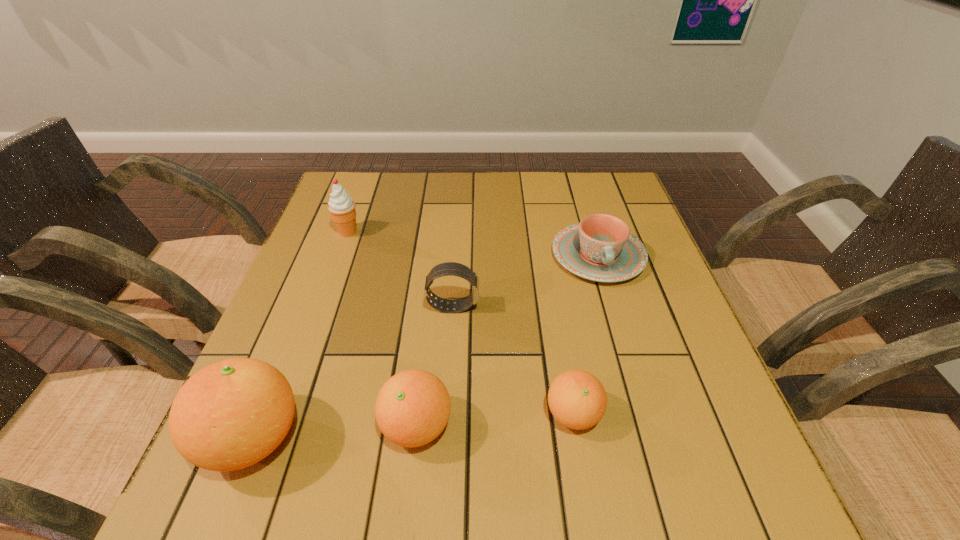
This screenshot has height=540, width=960. Find the location of `free region at the near left corner of the desktop`. free region at the near left corner of the desktop is located at coordinates (310, 436).

The height and width of the screenshot is (540, 960). Find the location of `vacant position at the far right corner of the desktop`. vacant position at the far right corner of the desktop is located at coordinates (575, 184).

You are a GUI agent. You are given a task and a screenshot of the screen. Output one action in this format:
    pyautogui.click(x=<x>, y=<y>)
    Task: Click on the free space between the second tallest orange and the chinaware
    The image size is (960, 540).
    Given the screenshot: What is the action you would take?
    pyautogui.click(x=508, y=341)

Image resolution: width=960 pixels, height=540 pixels. Identify the location of free space between the watch and the leftmost orange. (353, 373).

Image resolution: width=960 pixels, height=540 pixels. Identify the location of free point between the chinaware and the watch. (525, 281).

The height and width of the screenshot is (540, 960). What are the coordinates of `empty location between the second shortest orange and the rightmost orange` in the screenshot? It's located at (495, 420).

Identify the location of empty location between the icecream and the watch. (400, 269).

Where is `free space between the leftmost orange and the second shortest orange`? This screenshot has height=540, width=960. free space between the leftmost orange and the second shortest orange is located at coordinates (335, 432).

At what (x,y) coordinates should I click in order to perform the action: click on free space between the chinaware and the second orange from right to left. Please return your answer as a coordinate pair (x, y). This screenshot has width=960, height=540. Looking at the image, I should click on (508, 341).

At what (x,y) coordinates should I click in order to perform the action: click on free spot between the icecream and the second orange from right to left. Please return your answer as a coordinate pair (x, y). This screenshot has height=540, width=960. Looking at the image, I should click on (382, 329).